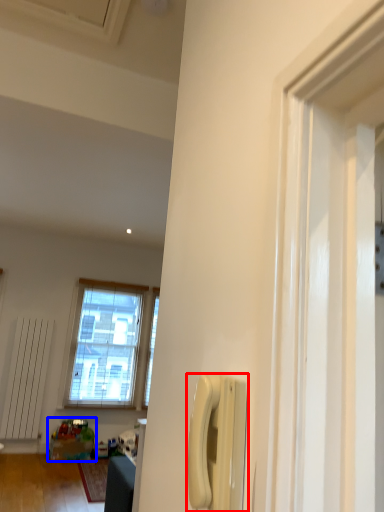
Question: Which object is further to the camera taking this photo, corded phone (highlighted by a red box) or toy (highlighted by a blue box)?

Choices:
 (A) corded phone
 (B) toy

Answer: (B)